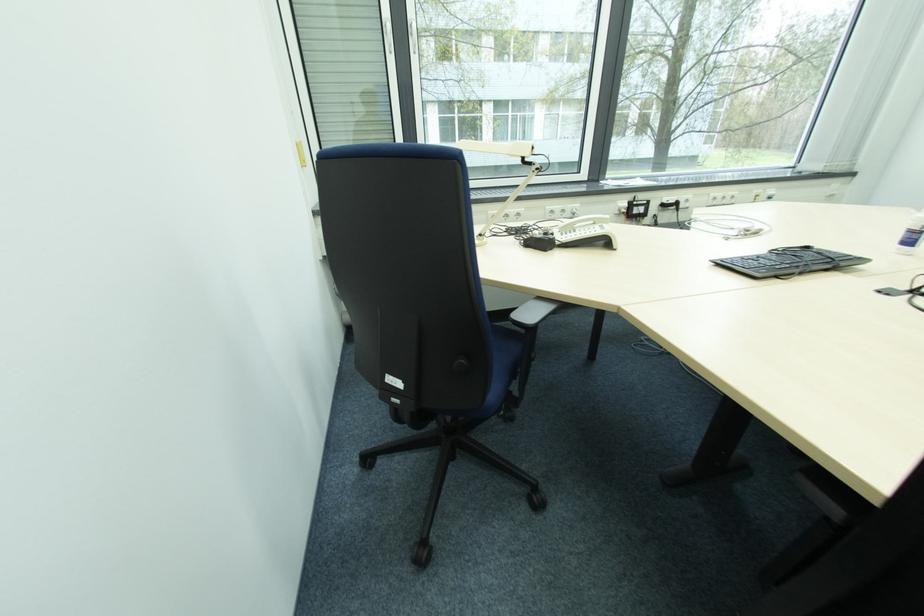
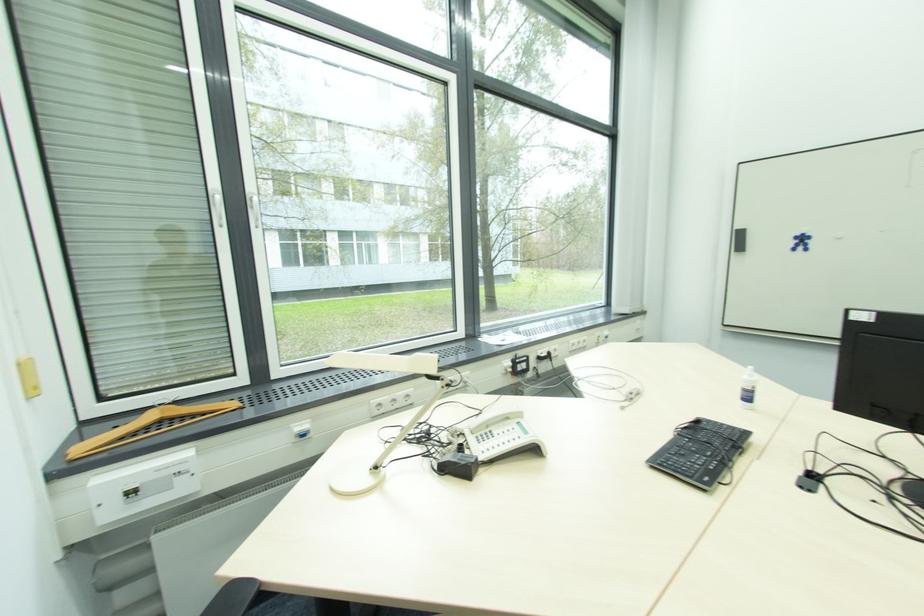
In the second image, find the point that corresponds to [597,225] in the first image.

(512, 421)